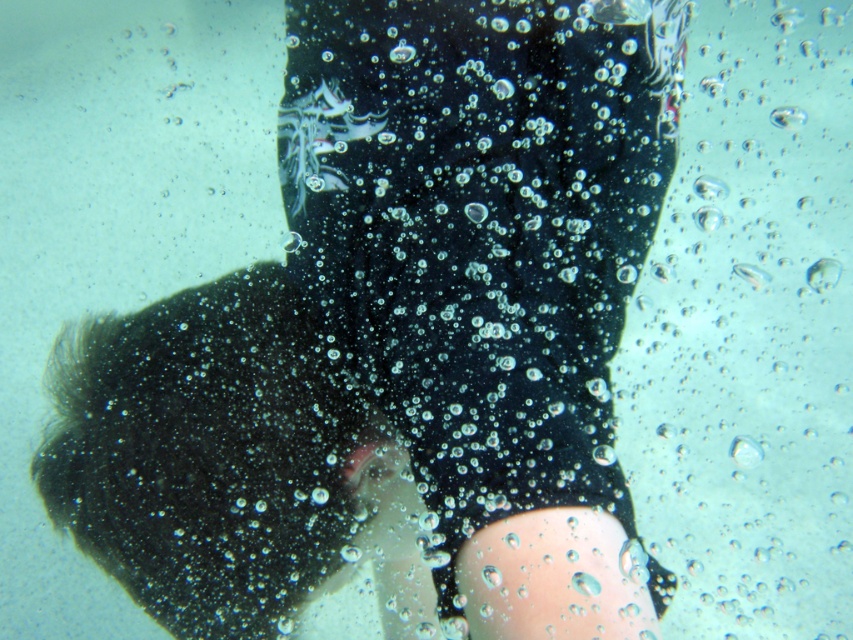
Does point (589, 276) lie behind point (784, 120)?

No, it is not.

I want to click on black matte wetsuit at center, so click(488, 272).

I want to click on black matte wetsuit at center, so click(488, 272).

Between transparent bubbly water at center and transparent bubbly water at upper center, which one appears on the right side from the viewer's perspective?

transparent bubbly water at upper center

Does point (737, 451) come closer to viewer compared to point (804, 113)?

Yes, it is.

Image resolution: width=853 pixels, height=640 pixels. Find the location of `transparent bubbly water at center`. transparent bubbly water at center is located at coordinates (746, 451).

Can you confirm if black matte wetsuit at center is taller than transparent bubbly water at center?

Indeed, black matte wetsuit at center has a greater height compared to transparent bubbly water at center.

Does black matte wetsuit at center appear over transparent bubbly water at center?

Yes, black matte wetsuit at center is above transparent bubbly water at center.

Between point (503, 212) and point (741, 435), which one is positioned in front?

Point (503, 212) is more forward.

The image size is (853, 640). Find the location of `black matte wetsuit at center`. black matte wetsuit at center is located at coordinates (488, 272).